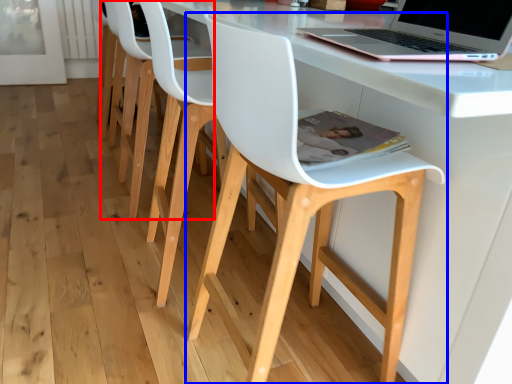
Question: Which point is closer to the camera, chair (highlighted by a red box) or chair (highlighted by a blue box)?

Choices:
 (A) chair
 (B) chair

Answer: (B)